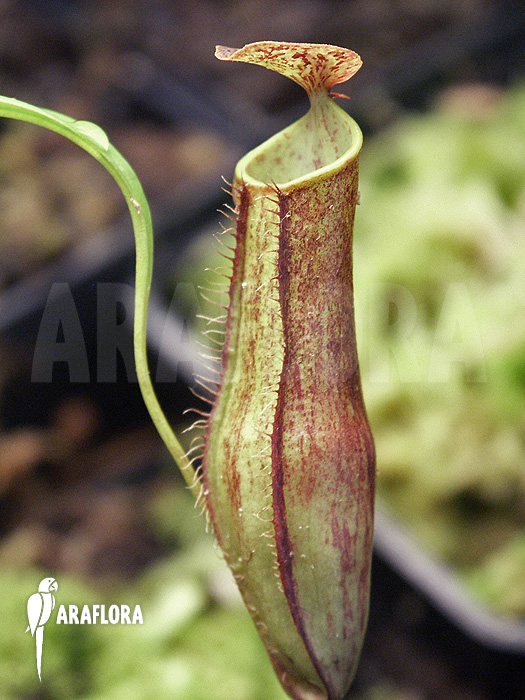
I want to click on chest, so click(x=43, y=602).